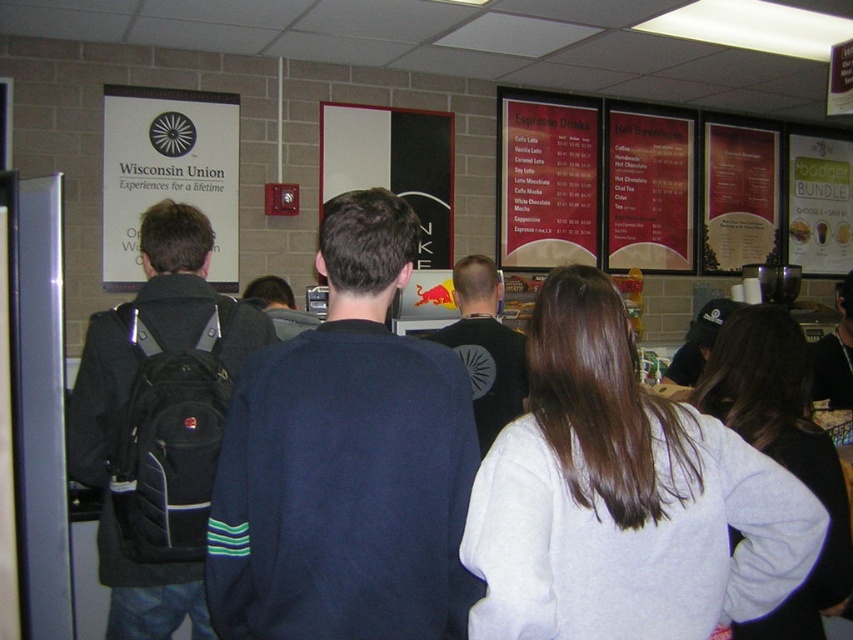
Question: Which of the following is the farthest from the observer?

Choices:
 (A) gray fleece sweatshirt at center
 (B) black fabric shirt at center

Answer: (B)

Question: Does dark blue sweater at center lie behind gray fleece sweatshirt at center?

Choices:
 (A) no
 (B) yes

Answer: (A)

Question: Which point is farther to the camera?

Choices:
 (A) black fabric shirt at center
 (B) white fleece sweatshirt at center
 (C) gray fleece sweatshirt at center

Answer: (A)

Question: Estimate the real-world distances between objects in this image. Which object is closer to the black backpack at left?

Choices:
 (A) white fleece sweatshirt at center
 (B) black fabric shirt at center
 (C) dark blue sweater at center
 (D) gray fleece sweatshirt at center

Answer: (C)

Question: From the image, what is the correct spatial relationship of white fleece sweatshirt at center in relation to black backpack at left?

Choices:
 (A) right
 (B) left

Answer: (A)

Question: Is dark blue sweater at center closer to the viewer compared to black fabric shirt at center?

Choices:
 (A) yes
 (B) no

Answer: (A)